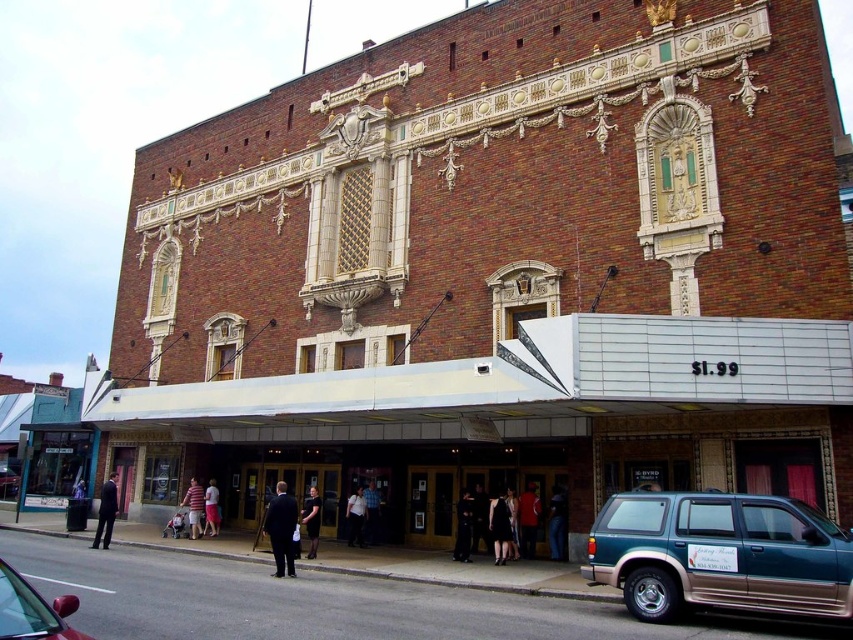
You are standing in front of the theater and want to locate two specific points on its facade. The first point is at coordinate point [695,548] and the second is at point [312,486]. Which point is closer to you?

Point [695,548] is in front of point [312,486], so it is closer to you.

Based on the photo, you are attending a theater event and see two outfits displayed on mannequins inside the theater lobby. The black dress at center and the dark blue suit at center are both on display. Which outfit is taller?

The black dress at center is taller than the dark blue suit at center.

In the scene shown: You are a theater usher who needs to guide a guest to their seat. The guest is standing in front of the theater entrance and wants to know if they can pass between the black dress at center and the dark blue suit at center without touching either. The guest is carrying a 12 inch wide box. Can they fit through?

The black dress at center might be wider than dark blue suit at center, so there is uncertainty about the available space between them. The guest should check the actual distance before attempting to pass with the 12 inch wide box.